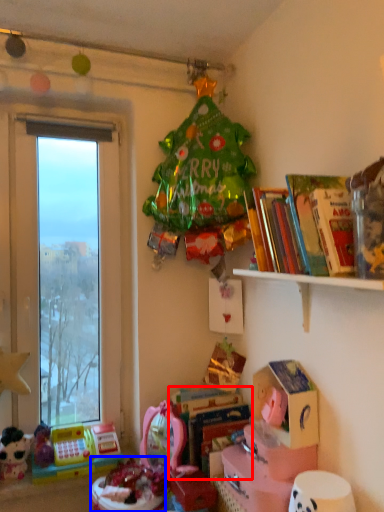
Question: Which point is further to the camera, book (highlighted by a red box) or toy (highlighted by a blue box)?

Choices:
 (A) book
 (B) toy

Answer: (A)